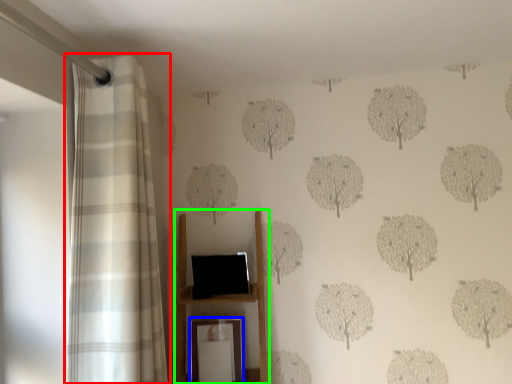
Question: Which object is the farthest from curtain (highlighted by a red box)? Choose among these: picture frame (highlighted by a blue box) or furniture (highlighted by a green box).

Choices:
 (A) picture frame
 (B) furniture

Answer: (A)